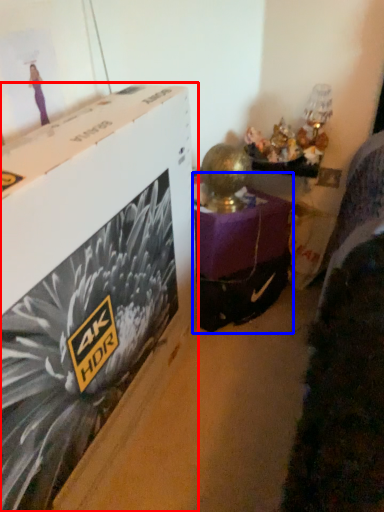
Question: Which point is further to the camera, box (highlighted by a red box) or furniture (highlighted by a blue box)?

Choices:
 (A) box
 (B) furniture

Answer: (B)